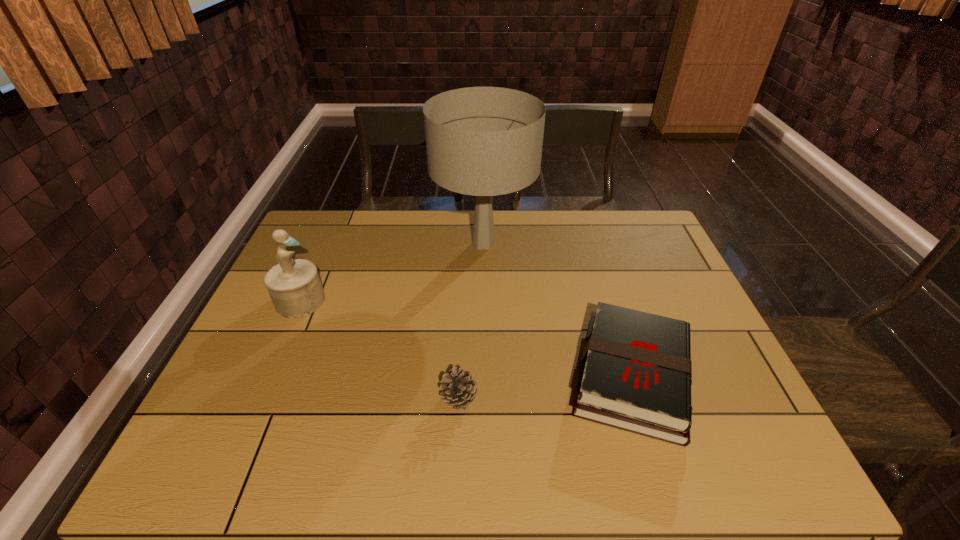
You are a GUI agent. You are given a task and a screenshot of the screen. Output one action in this format:
    pyautogui.click(x=<x>, y=<y>)
    Task: Click on the tallest object
    The height and width of the screenshot is (540, 960).
    Given the screenshot: What is the action you would take?
    pyautogui.click(x=483, y=141)

What are the coordinates of `the farthest object` in the screenshot? It's located at (483, 141).

Locate an element on the screen. The width and height of the screenshot is (960, 540). the second farthest object is located at coordinates (294, 286).

Where is `the leftmost object`? This screenshot has width=960, height=540. the leftmost object is located at coordinates (294, 286).

This screenshot has height=540, width=960. Identify the location of pinecone. (460, 390).

Locate an element on the screen. Image resolution: width=960 pixels, height=540 pixels. the rightmost object is located at coordinates (636, 371).

I want to click on free space located on the front-facing side of the farthest object, so click(338, 244).

Identify the location of vacant space located 0.340m on the front-facing side of the farthest object. (329, 244).

The width and height of the screenshot is (960, 540). Find the location of `free space located 0.360m on the front-facing side of the farthest object`. free space located 0.360m on the front-facing side of the farthest object is located at coordinates (323, 244).

Find the location of a particular element. free space located 0.170m at the beak of the third nearest object is located at coordinates (385, 300).